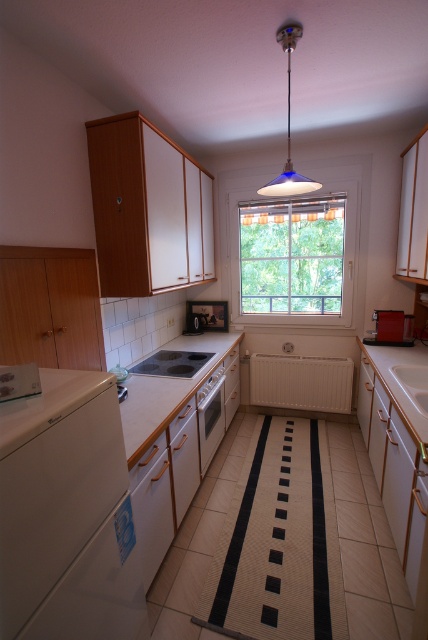
You are standing in the kitchen and want to place a dish on the white laminate countertop at center. To reach it, you need to walk around the white matte dishwasher at lower left. Is the countertop higher or lower than the dishwasher?

The white laminate countertop at center is higher than the white matte dishwasher at lower left because it is positioned at the center, which is typically elevated in kitchen layouts.

You are a chef preparing a meal and need to place several ingredients on the counter. Given the white laminate countertop at center and the white glossy sink at center, which surface has enough space to accommodate all your ingredients?

The white laminate countertop at center is larger in size than the white glossy sink at center, so it has enough space to accommodate all your ingredients.